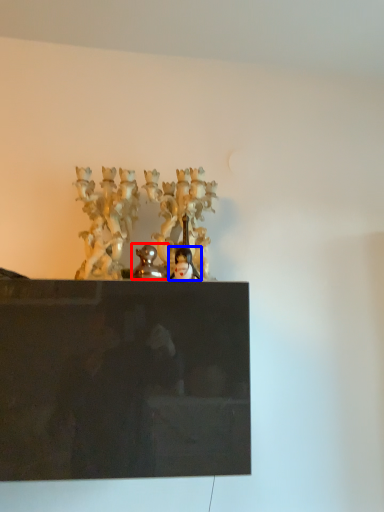
Question: Which object appears farthest to the camera in this image, sculpture (highlighted by a red box) or person (highlighted by a blue box)?

Choices:
 (A) sculpture
 (B) person

Answer: (B)